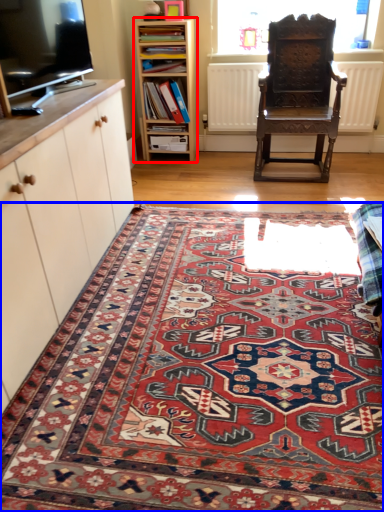
Question: Which point is closer to the camera, shelf (highlighted by a red box) or mat (highlighted by a blue box)?

Choices:
 (A) shelf
 (B) mat

Answer: (B)